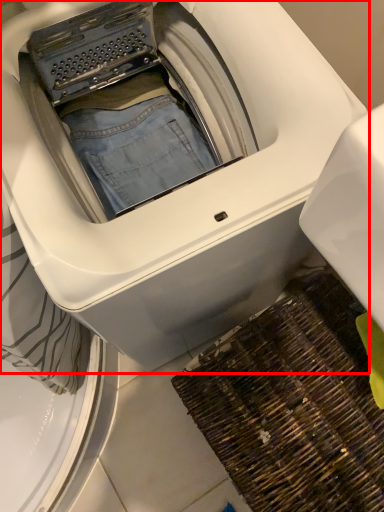
Question: Considering the relative positions of washing machine (annotated by the red box) and doormat in the image provided, where is washing machine (annotated by the red box) located with respect to the staircase?

Choices:
 (A) right
 (B) left

Answer: (B)